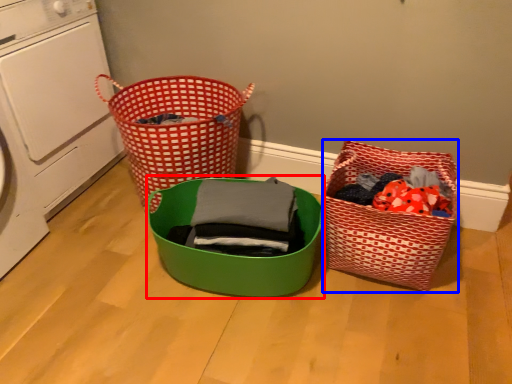
Question: Among these objects, which one is farthest to the camera, basket (highlighted by a red box) or basket (highlighted by a blue box)?

Choices:
 (A) basket
 (B) basket

Answer: (B)